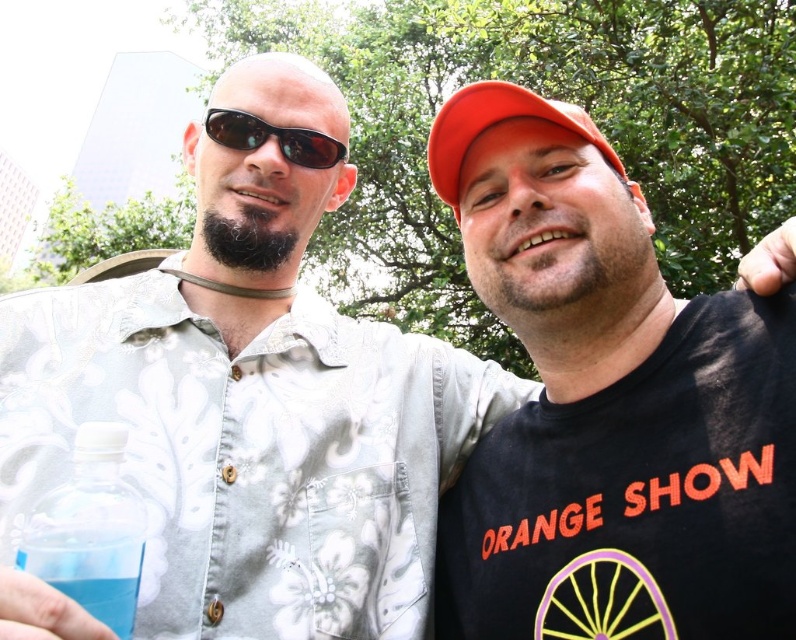
You are standing at point A located at coordinates point (420, 381) and want to walk to point B located at point (57, 547). Is there any obstruction between these two points?

Point (420, 381) is behind point (57, 547), so there is no obstruction between them.

You are standing in front of the two people at the event. You want to take a photo of them both clearly. Considering the distance between you and the point at the center of the image, which is point (77, 588), will they both be in focus if you focus on that point?

The distance between the camera and point (77, 588) is 27.05 inches. Since both people are likely within the depth of field at this distance, focusing on that point should keep both in focus.